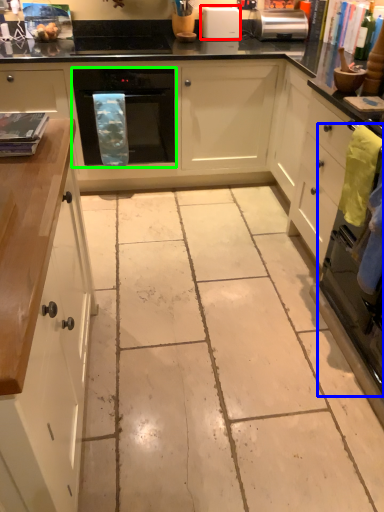
Question: Which object is the closest to the kitchen appliance (highlighted by a red box)? Choose among these: oven (highlighted by a blue box) or home appliance (highlighted by a green box).

Choices:
 (A) oven
 (B) home appliance

Answer: (B)